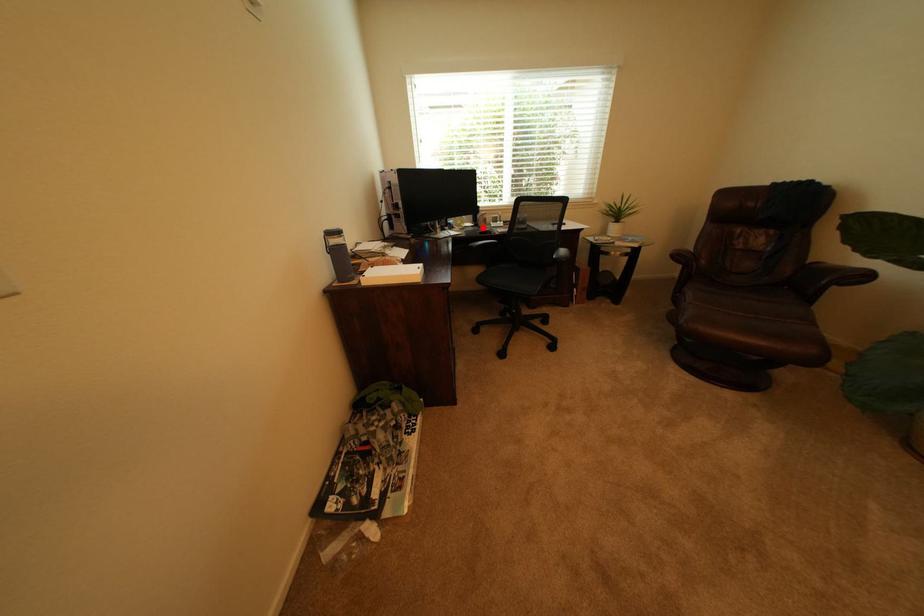
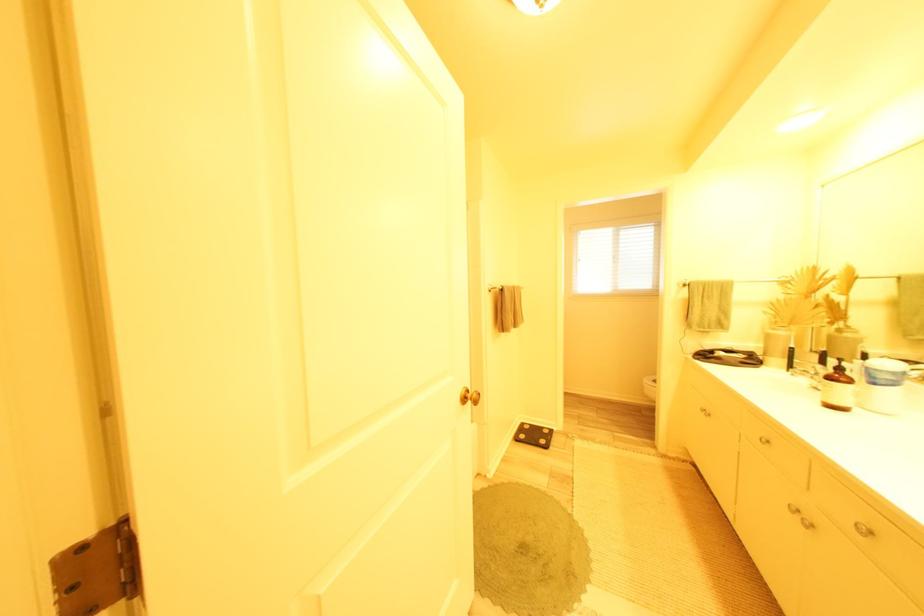
Question: I am providing you with two images of the same scene from different viewpoints. A red point is marked on the first image. At the location where the point appears in image 1, is it still visible in image 2?

Choices:
 (A) Yes
 (B) No

Answer: (B)